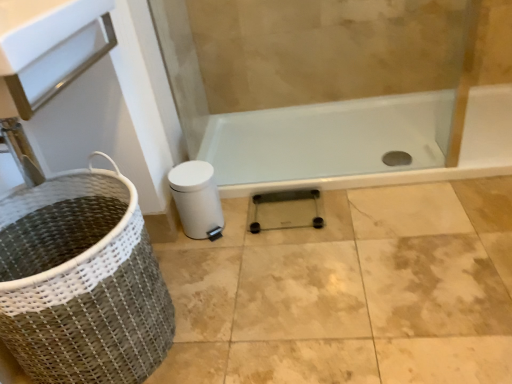
Find the location of a particular element. The width and height of the screenshot is (512, 384). woven fabric basket at lower left is located at coordinates (82, 282).

In order to face woven fabric basket at lower left, should I rotate leftwards or rightwards?

A 22.820 degree turn to the left will do.

What do you see at coordinates (82, 282) in the screenshot? This screenshot has width=512, height=384. I see `woven fabric basket at lower left` at bounding box center [82, 282].

The width and height of the screenshot is (512, 384). What do you see at coordinates (313, 229) in the screenshot?
I see `transparent glass scale at center` at bounding box center [313, 229].

Find the location of a particular element. This screenshot has height=384, width=512. transparent glass scale at center is located at coordinates (313, 229).

Measure the distance between transparent glass scale at center and camera.

1.55 meters.

What are the coordinates of `woven fabric basket at lower left` in the screenshot? It's located at tap(82, 282).

Can you confirm if woven fabric basket at lower left is positioned to the right of transparent glass scale at center?

Incorrect, woven fabric basket at lower left is not on the right side of transparent glass scale at center.

Considering their positions, is woven fabric basket at lower left located in front of or behind transparent glass scale at center?

woven fabric basket at lower left is in front of transparent glass scale at center.

Between point (76, 229) and point (245, 238), which one is positioned in front?

The point (76, 229) is in front.

From the image's perspective, does woven fabric basket at lower left appear lower than transparent glass scale at center?

Yes, from the image's perspective, woven fabric basket at lower left is beneath transparent glass scale at center.

From a real-world perspective, is woven fabric basket at lower left positioned under transparent glass scale at center based on gravity?

No, from a real-world perspective, woven fabric basket at lower left is not under transparent glass scale at center.

Looking at their sizes, would you say woven fabric basket at lower left is wider or thinner than transparent glass scale at center?

Considering their sizes, woven fabric basket at lower left looks broader than transparent glass scale at center.

Considering the relative sizes of woven fabric basket at lower left and transparent glass scale at center in the image provided, is woven fabric basket at lower left shorter than transparent glass scale at center?

In fact, woven fabric basket at lower left may be taller than transparent glass scale at center.

Can you confirm if woven fabric basket at lower left is bigger than transparent glass scale at center?

Indeed, woven fabric basket at lower left has a larger size compared to transparent glass scale at center.

Does woven fabric basket at lower left contain transparent glass scale at center?

No.

Is woven fabric basket at lower left positioned far away from transparent glass scale at center?

No, woven fabric basket at lower left is in close proximity to transparent glass scale at center.

Does woven fabric basket at lower left turn towards transparent glass scale at center?

No.

How different are the orientations of woven fabric basket at lower left and transparent glass scale at center in degrees?

90.5 degrees.

The height and width of the screenshot is (384, 512). Identify the location of basket container that appears in front of the transparent glass scale at center. (82, 282).

In the image, is transparent glass scale at center on the left side or the right side of woven fabric basket at lower left?

In the image, transparent glass scale at center appears on the right side of woven fabric basket at lower left.

Is transparent glass scale at center behind woven fabric basket at lower left?

Yes, transparent glass scale at center is further from the camera.

Is point (330, 202) positioned after point (89, 333)?

Yes, it is behind point (89, 333).

From the image's perspective, which object appears higher, transparent glass scale at center or woven fabric basket at lower left?

From the image's view, transparent glass scale at center is above.

From a real-world perspective, is transparent glass scale at center on top of woven fabric basket at lower left?

Incorrect, from a real-world perspective, transparent glass scale at center is lower than woven fabric basket at lower left.

In terms of width, does transparent glass scale at center look wider or thinner when compared to woven fabric basket at lower left?

Clearly, transparent glass scale at center has less width compared to woven fabric basket at lower left.

Is transparent glass scale at center taller than woven fabric basket at lower left?

No, transparent glass scale at center is not taller than woven fabric basket at lower left.

Is transparent glass scale at center bigger than woven fabric basket at lower left?

No.

Does transparent glass scale at center contain woven fabric basket at lower left?

That's incorrect, woven fabric basket at lower left is not inside transparent glass scale at center.

Would you say transparent glass scale at center is a long distance from woven fabric basket at lower left?

No, transparent glass scale at center is in close proximity to woven fabric basket at lower left.

Is transparent glass scale at center turned away from woven fabric basket at lower left?

No, transparent glass scale at center is not facing away from woven fabric basket at lower left.

This screenshot has width=512, height=384. I want to click on basket container positioned vertically above the transparent glass scale at center (from a real-world perspective), so click(x=82, y=282).

The image size is (512, 384). Identify the location of tile located above the woven fabric basket at lower left (from the image's perspective). (313, 229).

Identify the location of basket container lying below the transparent glass scale at center (from the image's perspective). The width and height of the screenshot is (512, 384). (82, 282).